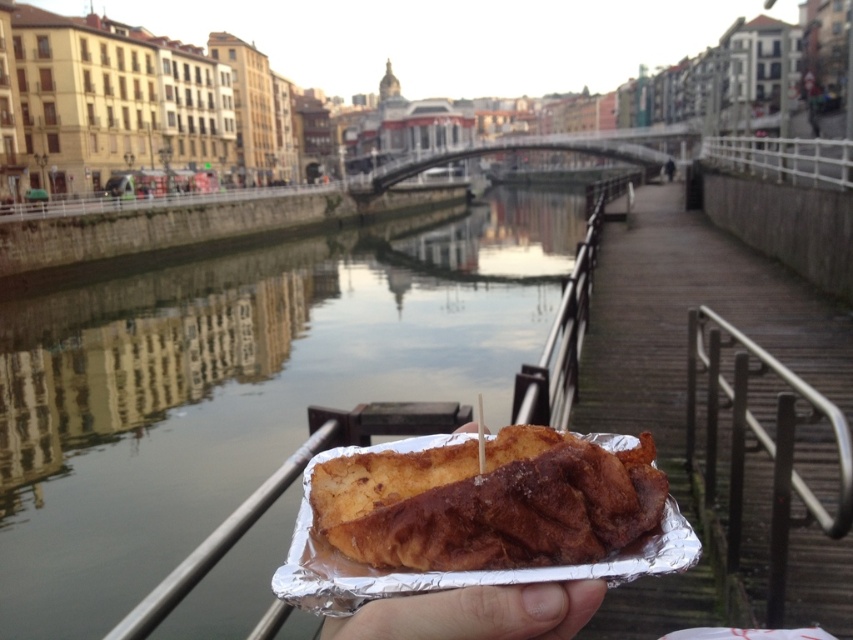
You are standing at the riverside and want to place a small pebble on the glossy concrete water at center and the satin silver railing at lower right. Which surface can you place the pebble on without it floating away?

The satin silver railing at lower right is the correct surface to place the pebble because the glossy concrete water at center is actually water and the pebble would float away or sink, whereas the railing is solid.